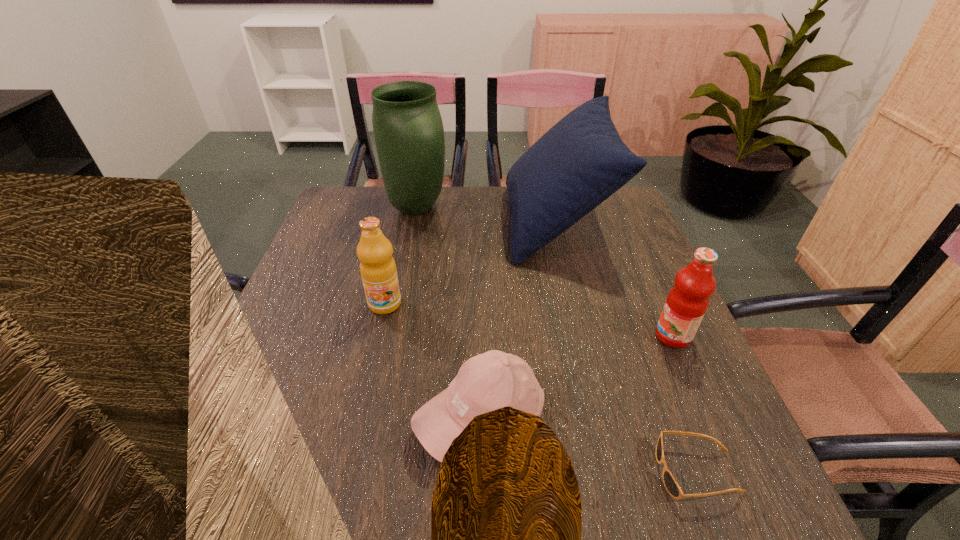
Find the location of `free spot between the right fruit juice and the sunglasses`. free spot between the right fruit juice and the sunglasses is located at coordinates (684, 404).

You are a GUI agent. You are given a task and a screenshot of the screen. Output one action in this format:
    pyautogui.click(x=<x>, y=<y>)
    Task: Click on the vacant space in between the second tallest object and the sunglasses
    The height and width of the screenshot is (540, 960).
    Given the screenshot: What is the action you would take?
    pos(626,347)

Locate an element on the screen. vacant space that's between the third nearest object and the baseball cap is located at coordinates (577, 377).

Where is `free space between the farther fruit juice and the fifth tallest object`? This screenshot has width=960, height=540. free space between the farther fruit juice and the fifth tallest object is located at coordinates (433, 361).

Locate an element on the screen. The height and width of the screenshot is (540, 960). vacant area that lies between the second tallest object and the shortest object is located at coordinates (626, 347).

This screenshot has width=960, height=540. I want to click on object that stands as the fourth closest to the vase, so click(x=685, y=306).

In order to click on object that is the third nearest to the shortest object in this screenshot , I will do `click(581, 161)`.

Locate an element on the screen. vacant region that satisfies the following two spatial constraints: 1. on the facing side of the fifth shortest object; 2. on the front-facing side of the baseball cap is located at coordinates (601, 418).

You are a GUI agent. You are given a task and a screenshot of the screen. Output one action in this format:
    pyautogui.click(x=<x>, y=<y>)
    Task: Click on the vacant space that satisfies the following two spatial constraints: 1. on the front label of the right fruit juice; 2. on the front-facing side of the second shortest object
    
    Given the screenshot: What is the action you would take?
    pyautogui.click(x=708, y=418)

Identify the location of free space that satisfies the following two spatial constraints: 1. on the front label of the third nearest object; 2. on the front-facing side of the baseball cap. The height and width of the screenshot is (540, 960). (708, 418).